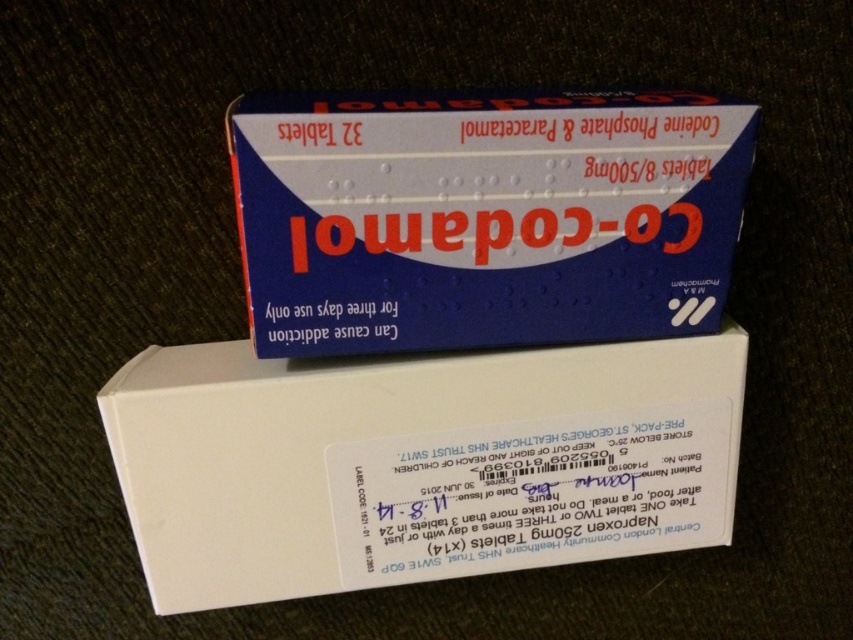
You are organizing a medicine cabinet and need to place the white cardboard box at center and the blue cardboard box at upper center. Which box should you place on the lower shelf to accommodate their sizes?

The blue cardboard box at upper center should be placed on the lower shelf because it is shorter than the white cardboard box at center, which is taller and needs more space on a higher shelf.

You are organizing a medicine cabinet and see the white cardboard box at center and the blue cardboard box at upper center. Which box is positioned more to the left side of the medicine cabinet?

The white cardboard box at center is positioned more to the left side of the medicine cabinet than the blue cardboard box at upper center.

You are a delivery person who just arrived at a customer doorstep. You have two boxes to deliver. The white cardboard box at center is the first one you need to hand over. The second box is blue with red and white text. How far apart are the two boxes?

The two boxes are 38.56 inches apart.